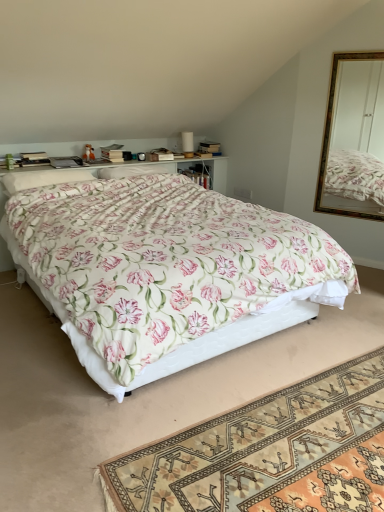
Question: Does floral fabric rug at lower center have a larger size compared to hardcover book at upper left?

Choices:
 (A) yes
 (B) no

Answer: (A)

Question: Considering the relative sizes of floral fabric rug at lower center and hardcover book at upper left in the image provided, is floral fabric rug at lower center smaller than hardcover book at upper left?

Choices:
 (A) no
 (B) yes

Answer: (A)

Question: Does floral fabric rug at lower center have a greater width compared to hardcover book at upper left?

Choices:
 (A) no
 (B) yes

Answer: (B)

Question: Does floral fabric rug at lower center have a greater height compared to hardcover book at upper left?

Choices:
 (A) yes
 (B) no

Answer: (B)

Question: Can you confirm if floral fabric rug at lower center is positioned to the right of hardcover book at upper left?

Choices:
 (A) yes
 (B) no

Answer: (A)

Question: Is hardcover book at upper left in front of or behind matte brown box at upper center in the image?

Choices:
 (A) front
 (B) behind

Answer: (A)

Question: Based on their positions, is hardcover book at upper left located to the left or right of matte brown box at upper center?

Choices:
 (A) right
 (B) left

Answer: (B)

Question: In terms of height, does hardcover book at upper left look taller or shorter compared to matte brown box at upper center?

Choices:
 (A) tall
 (B) short

Answer: (A)

Question: From a real-world perspective, relative to matte brown box at upper center, is hardcover book at upper left vertically above or below?

Choices:
 (A) above
 (B) below

Answer: (B)

Question: Which is correct: gold-framed mirror at upper right is inside floral fabric bed at center, or outside of it?

Choices:
 (A) inside
 (B) outside

Answer: (B)

Question: Is gold-framed mirror at upper right wider or thinner than floral fabric bed at center?

Choices:
 (A) thin
 (B) wide

Answer: (A)

Question: Is gold-framed mirror at upper right to the left or to the right of floral fabric bed at center in the image?

Choices:
 (A) left
 (B) right

Answer: (B)

Question: From the image's perspective, is gold-framed mirror at upper right positioned above or below floral fabric bed at center?

Choices:
 (A) below
 (B) above

Answer: (B)

Question: Considering their positions, is floral fabric pillow at center, which ranks as the 2th pillow in left-to-right order, located in front of or behind floral fabric rug at lower center?

Choices:
 (A) front
 (B) behind

Answer: (B)

Question: From their relative heights in the image, would you say floral fabric pillow at center, the first pillow when ordered from back to front, is taller or shorter than floral fabric rug at lower center?

Choices:
 (A) tall
 (B) short

Answer: (A)